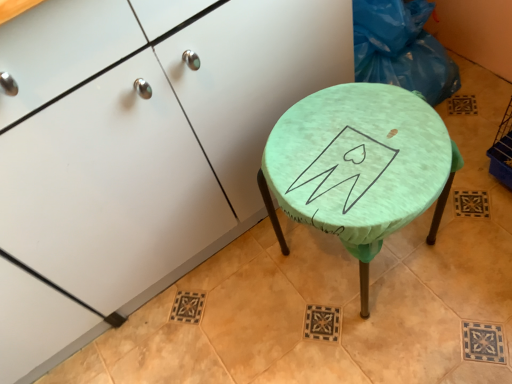
Image resolution: width=512 pixels, height=384 pixels. Find the location of `vacant area that lies to the right of green fabric-covered stool at center`. vacant area that lies to the right of green fabric-covered stool at center is located at coordinates (473, 224).